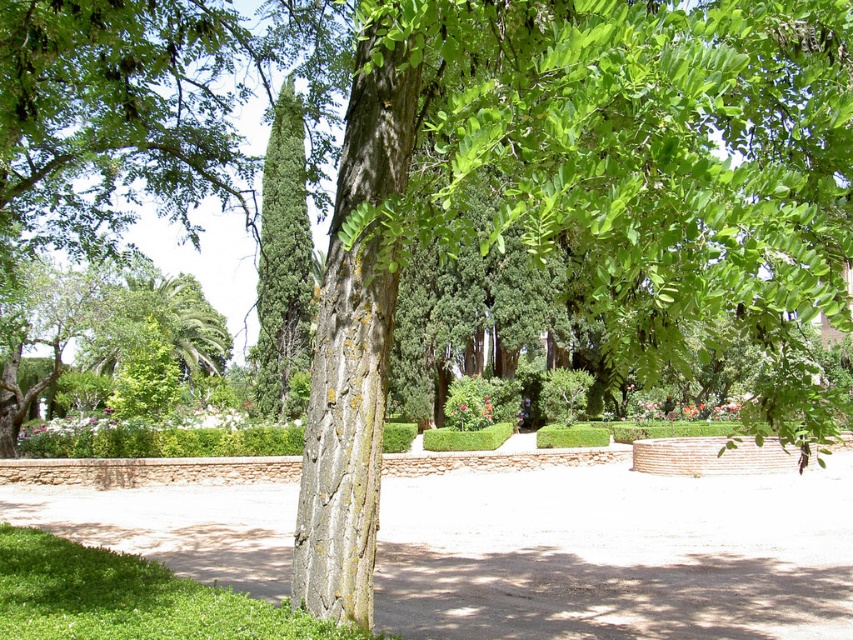
Locate an element on the screen. This screenshot has width=853, height=640. smooth bark tree trunk at center is located at coordinates (357, 323).

Which of these two, smooth bark tree trunk at center or green textured cypress at center, stands taller?

Standing taller between the two is green textured cypress at center.

Find the location of a particular element. The image size is (853, 640). smooth bark tree trunk at center is located at coordinates (357, 323).